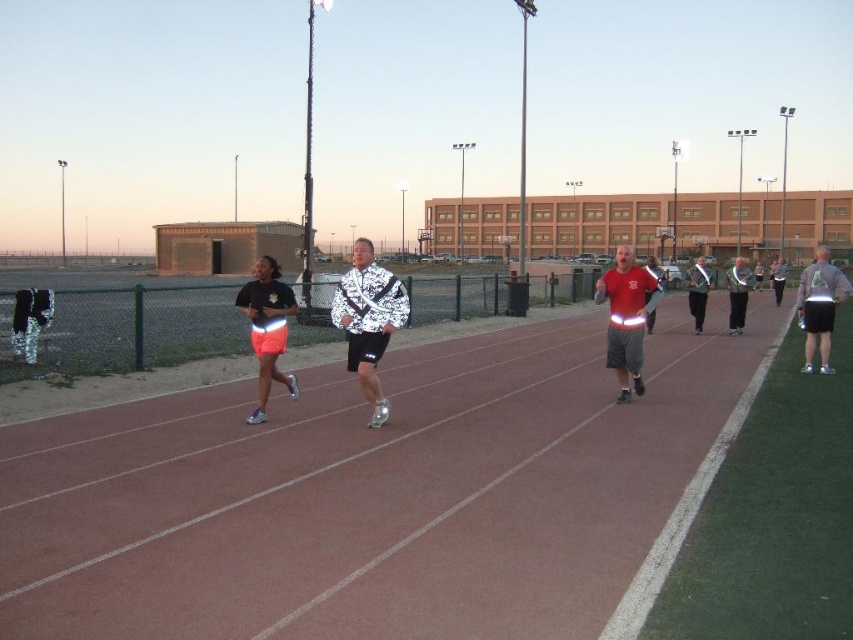
Is neon orange shorts at center positioned in front of reflective silver jacket at right?

Yes, neon orange shorts at center is closer to the viewer.

Can you confirm if neon orange shorts at center is wider than reflective silver jacket at right?

In fact, neon orange shorts at center might be narrower than reflective silver jacket at right.

The width and height of the screenshot is (853, 640). I want to click on neon orange shorts at center, so click(267, 326).

Between reflective fabric shorts at center and gray matte shorts at right, which one appears on the right side from the viewer's perspective?

gray matte shorts at right

Who is more distant from viewer, (x=625, y=324) or (x=828, y=324)?

The point (x=828, y=324) is behind.

Is point (631, 264) farther from camera compared to point (814, 275)?

No, (631, 264) is in front of (814, 275).

Where is `reflective fabric shorts at center`? The image size is (853, 640). reflective fabric shorts at center is located at coordinates (625, 317).

Can you confirm if neon orange shorts at center is thinner than gray matte shorts at right?

Indeed, neon orange shorts at center has a lesser width compared to gray matte shorts at right.

Which is in front, point (287, 378) or point (809, 316)?

Point (287, 378) is more forward.

In order to click on neon orange shorts at center in this screenshot , I will do `click(267, 326)`.